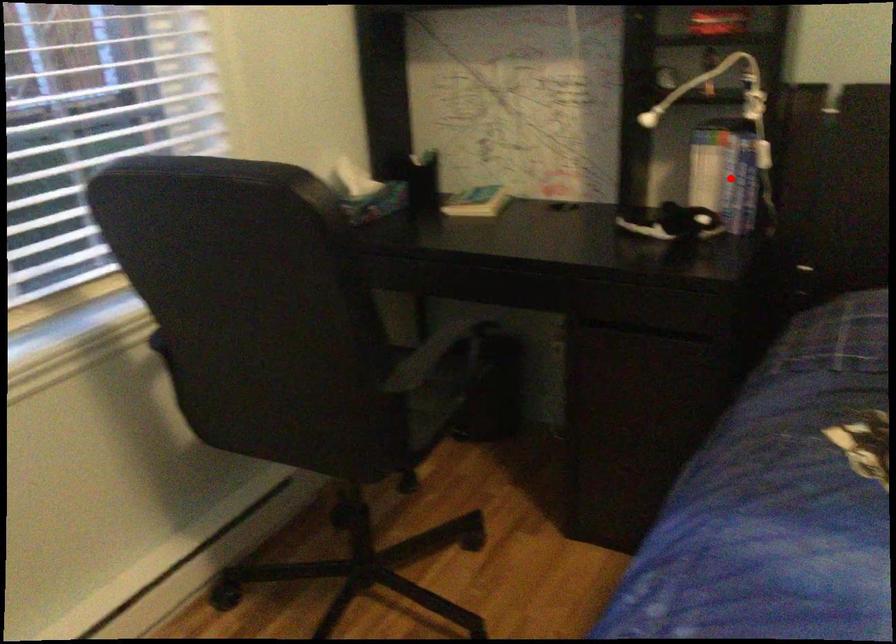
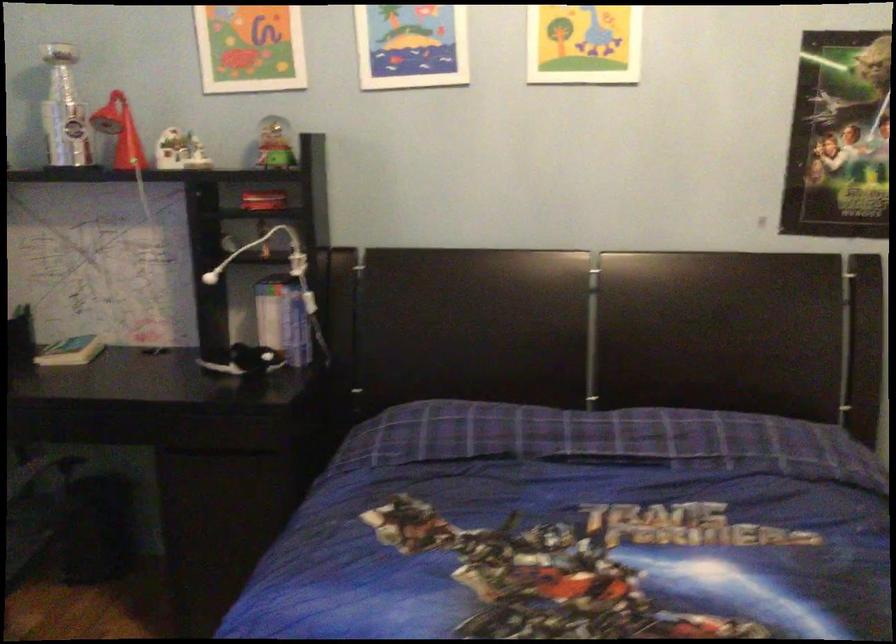
The point at the highlighted location is marked in the first image. Where is the corresponding point in the second image?

(288, 321)